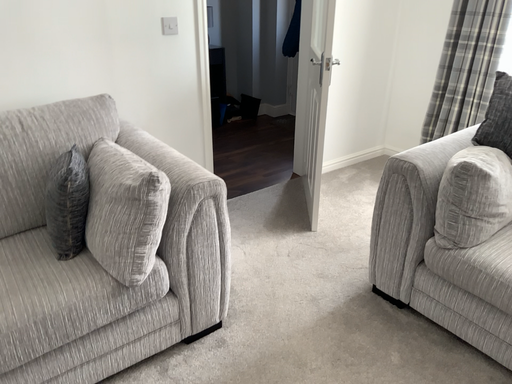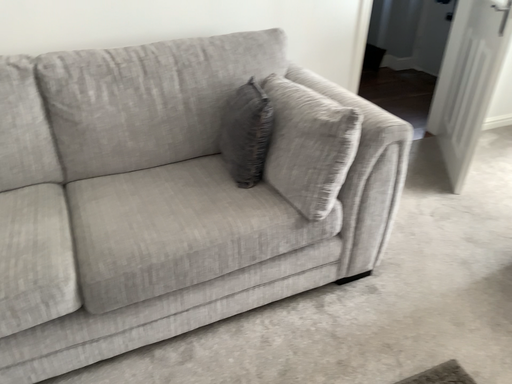
Question: How did the camera likely rotate when shooting the video?

Choices:
 (A) rotated right
 (B) rotated left

Answer: (B)